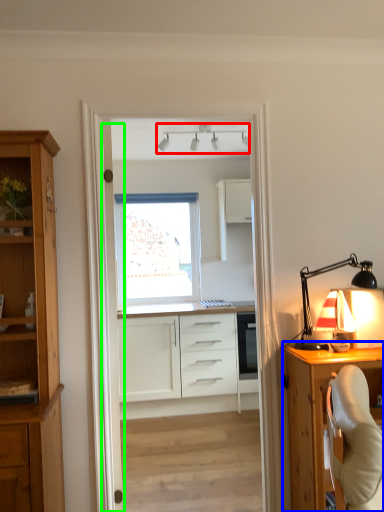
Question: Based on their relative distances, which object is nearer to lamp (highlighted by a red box)? Choose from cabinetry (highlighted by a blue box) and door (highlighted by a green box).

Choices:
 (A) cabinetry
 (B) door

Answer: (B)